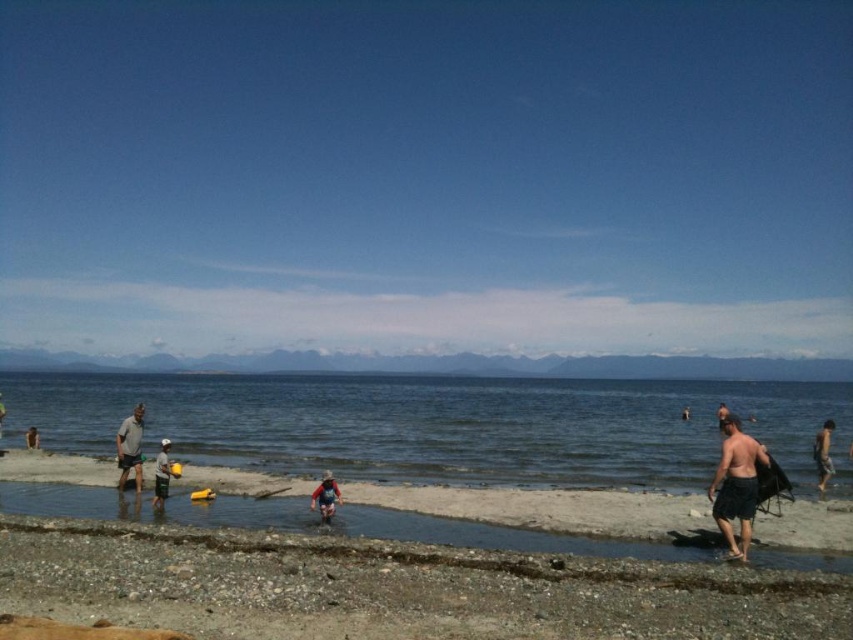
Does smooth sand beach at center appear over shiny black shorts at right?

No, smooth sand beach at center is not above shiny black shorts at right.

Between smooth sand beach at center and shiny black shorts at right, which one is positioned higher?

shiny black shorts at right is higher up.

Does point (688, 545) lie behind point (721, 420)?

No, (688, 545) is in front of (721, 420).

This screenshot has height=640, width=853. Find the location of `smooth sand beach at center`. smooth sand beach at center is located at coordinates (532, 518).

The height and width of the screenshot is (640, 853). Describe the element at coordinates (393, 589) in the screenshot. I see `smooth brown sand at lower center` at that location.

Between smooth brown sand at lower center and matte gray shorts at left, which one is positioned lower?

matte gray shorts at left is lower down.

Between point (19, 609) and point (126, 433), which one is positioned in front?

Point (19, 609) is in front.

I want to click on smooth brown sand at lower center, so click(393, 589).

Measure the distance from shiny black shorts at right to red fabric backpack at center.

shiny black shorts at right and red fabric backpack at center are 6.63 meters apart from each other.

Who is more distant from viewer, [738,424] or [328,502]?

The point [328,502] is behind.

You are a GUI agent. You are given a task and a screenshot of the screen. Output one action in this format:
    pyautogui.click(x=<x>, y=<y>)
    Task: Click on the shiny black shorts at right
    
    Given the screenshot: What is the action you would take?
    pyautogui.click(x=735, y=484)